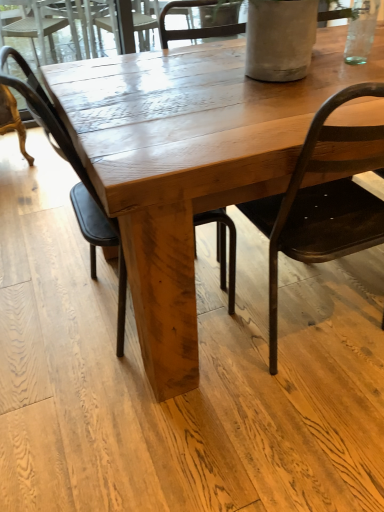
Question: Does matte black chair at center, the first chair from the left, have a smaller size compared to wooden table at center?

Choices:
 (A) yes
 (B) no

Answer: (A)

Question: From a real-world perspective, is matte black chair at center, which is counted as the 2th chair, starting from the right, positioned over wooden table at center based on gravity?

Choices:
 (A) yes
 (B) no

Answer: (A)

Question: Is matte black chair at center, which is counted as the 2th chair, starting from the right, placed right next to wooden table at center?

Choices:
 (A) yes
 (B) no

Answer: (B)

Question: From the image's perspective, is matte black chair at center, the first chair from the left, below wooden table at center?

Choices:
 (A) no
 (B) yes

Answer: (B)

Question: Does matte black chair at center, the first chair from the left, turn towards wooden table at center?

Choices:
 (A) yes
 (B) no

Answer: (A)

Question: Is matte black chair at right, acting as the 2th chair starting from the left, situated inside matte black chair at center, which is counted as the 2th chair, starting from the right, or outside?

Choices:
 (A) outside
 (B) inside

Answer: (A)

Question: Looking at the image, does matte black chair at right, acting as the 2th chair starting from the left, seem bigger or smaller compared to matte black chair at center, the first chair from the left?

Choices:
 (A) small
 (B) big

Answer: (B)

Question: In terms of height, does matte black chair at right, acting as the 2th chair starting from the left, look taller or shorter compared to matte black chair at center, the first chair from the left?

Choices:
 (A) tall
 (B) short

Answer: (B)

Question: In the image, is matte black chair at right, which appears as the first chair when viewed from the right, on the left side or the right side of matte black chair at center, which is counted as the 2th chair, starting from the right?

Choices:
 (A) right
 (B) left

Answer: (A)

Question: In terms of height, does wooden table at center look taller or shorter compared to matte black chair at right, acting as the 2th chair starting from the left?

Choices:
 (A) tall
 (B) short

Answer: (B)

Question: Is wooden table at center wider or thinner than matte black chair at right, acting as the 2th chair starting from the left?

Choices:
 (A) wide
 (B) thin

Answer: (A)

Question: Looking at the image, does wooden table at center seem bigger or smaller compared to matte black chair at right, acting as the 2th chair starting from the left?

Choices:
 (A) small
 (B) big

Answer: (B)

Question: In the image, is wooden table at center positioned in front of or behind matte black chair at right, acting as the 2th chair starting from the left?

Choices:
 (A) front
 (B) behind

Answer: (B)

Question: In terms of height, does matte black chair at center, which is counted as the 2th chair, starting from the right, look taller or shorter compared to wooden table at center?

Choices:
 (A) short
 (B) tall

Answer: (B)

Question: Would you say matte black chair at center, the first chair from the left, is to the left or to the right of wooden table at center in the picture?

Choices:
 (A) left
 (B) right

Answer: (A)